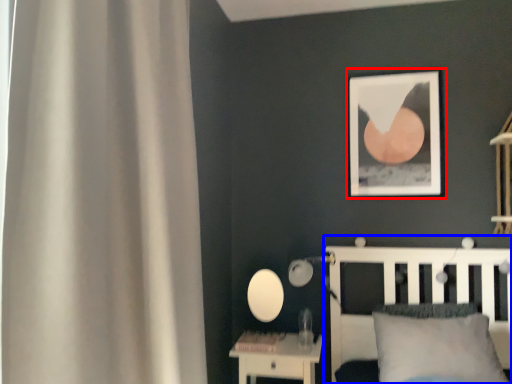
Question: Among these objects, which one is nearest to the camera, picture frame (highlighted by a red box) or bed (highlighted by a blue box)?

Choices:
 (A) picture frame
 (B) bed

Answer: (B)